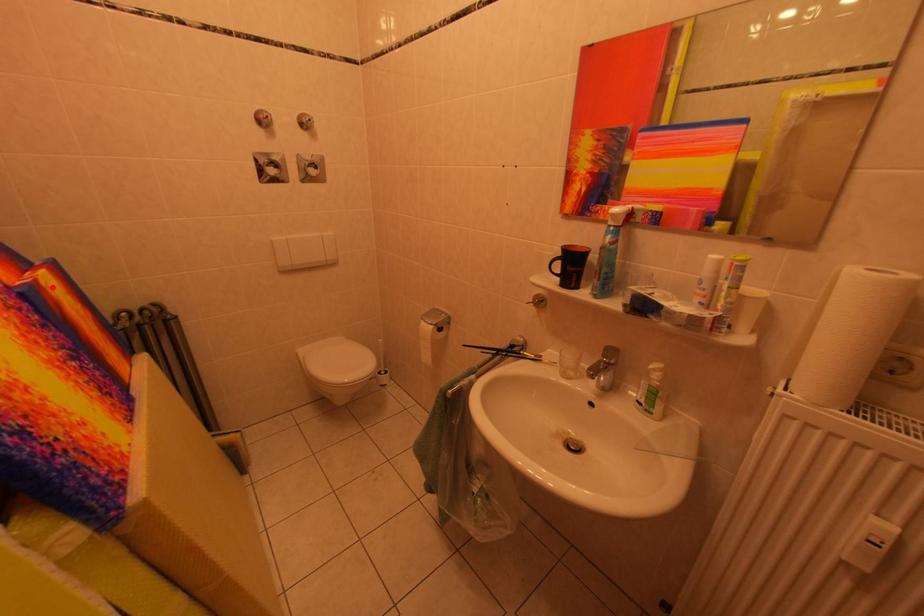
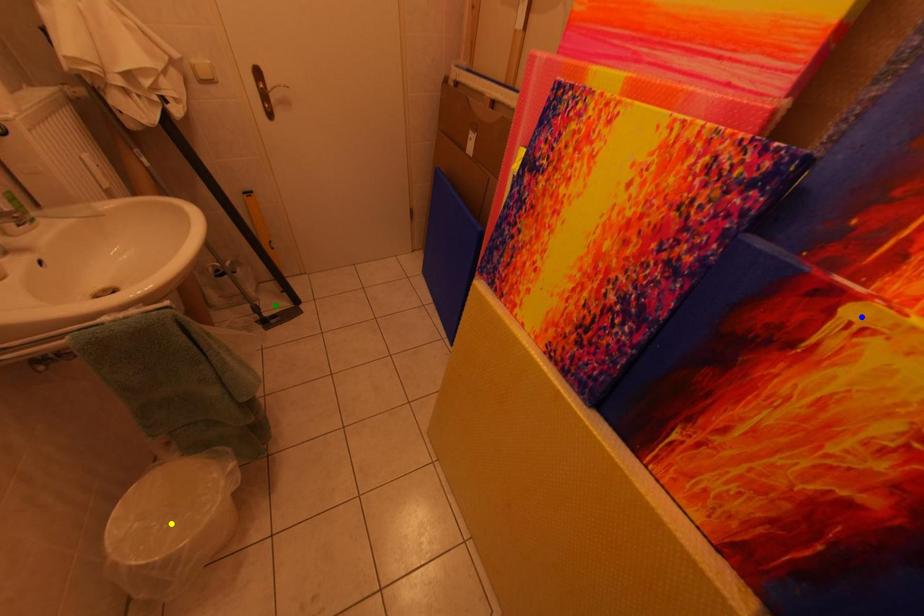
Question: I am providing you with two images of the same scene from different viewpoints. A red point is marked on the first image. You are given multiple points on the second image. Which point in image 2 is actually the same real-world point as the red point in image 1?

Choices:
 (A) blue point
 (B) yellow point
 (C) green point

Answer: (A)